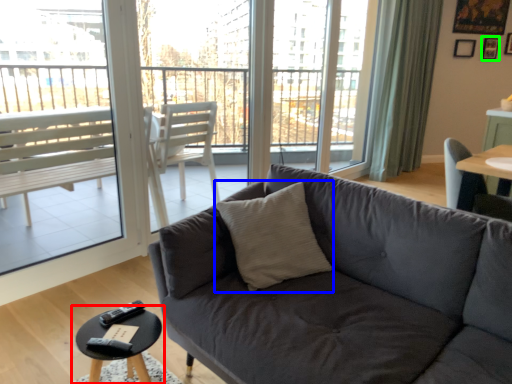
Question: Based on their relative distances, which object is farther from coffee table (highlighted by a red box)? Choose from throw pillow (highlighted by a blue box) and picture frame (highlighted by a green box).

Choices:
 (A) throw pillow
 (B) picture frame

Answer: (B)